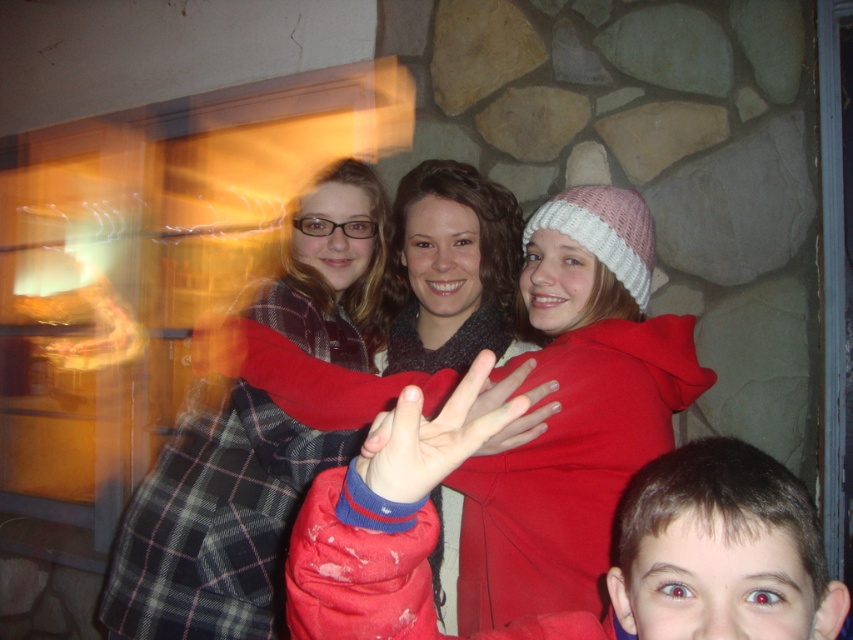
You are standing in front of a group photo of four people near a stone wall. You notice the matte red jacket at lower right and the knitted woolen hat at center. Based on their positions, which one is closer to the ground?

The matte red jacket at lower right is below the knitted woolen hat at center, so it is closer to the ground.

You are a photographer trying to capture a group photo of the matte red jacket at lower right and the knitted woolen hat at center. Since you want to ensure both are visible in the frame, which object should you position closer to the camera to avoid being blocked by the other?

The matte red jacket at lower right is positioned on the left side of knitted woolen hat at center. To avoid blocking, position the knitted woolen hat at center closer to the camera so it doesn not block the matte red jacket at lower right.